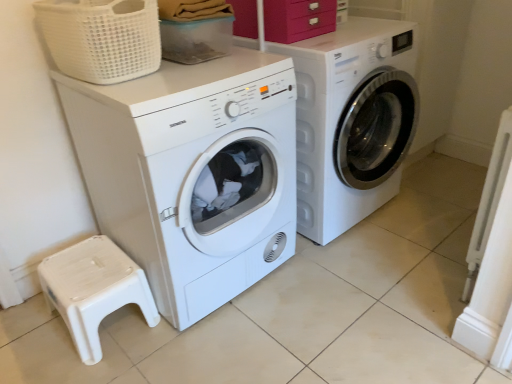
Find the location of a particular element. The width and height of the screenshot is (512, 384). vacant area to the left of white plastic step stool at lower left is located at coordinates (35, 336).